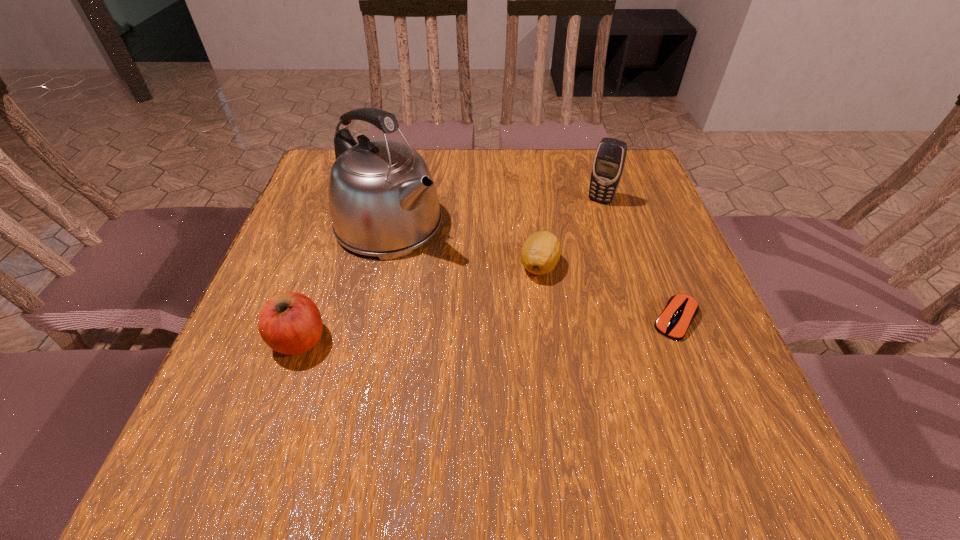
The width and height of the screenshot is (960, 540). Identify the location of free region located at the stem end of the lemon. (491, 313).

Find the location of a particular element. Image resolution: width=960 pixels, height=540 pixels. vacant space located on the front face of the fourth shortest object is located at coordinates (564, 262).

At what (x,y) coordinates should I click in order to perform the action: click on vacant space located on the front face of the fourth shortest object. Please return your answer as a coordinate pair (x, y). Looking at the image, I should click on (571, 249).

Where is `free spot located 0.360m on the front face of the fourth shortest object`? free spot located 0.360m on the front face of the fourth shortest object is located at coordinates (541, 302).

Identify the location of free space located on the spout of the tallest object. The height and width of the screenshot is (540, 960). (440, 259).

Identify the location of vacant area situated 0.110m on the spout of the tallest object. (458, 273).

This screenshot has height=540, width=960. Identify the location of vacant space located 0.060m on the spout of the tallest object. (443, 261).

I want to click on cellular telephone located at the far edge, so click(609, 161).

Locate an element on the screen. The width and height of the screenshot is (960, 540). kettle that is positioned at the far edge is located at coordinates (383, 202).

The image size is (960, 540). Find the location of `apple present at the left edge`. apple present at the left edge is located at coordinates (290, 323).